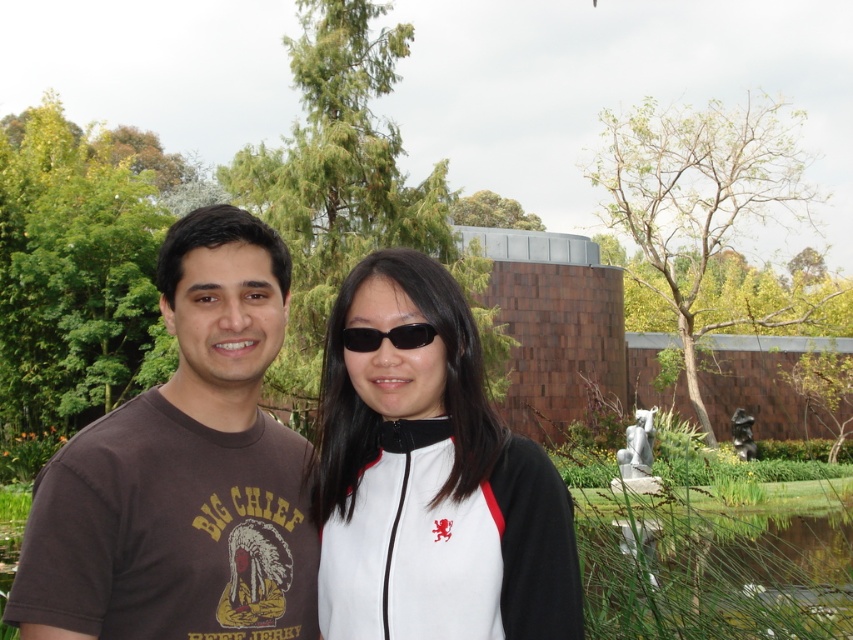
You are a GUI agent. You are given a task and a screenshot of the screen. Output one action in this format:
    pyautogui.click(x=<x>, y=<y>)
    Task: Click on the white matte jacket at center
    
    Given the screenshot: What is the action you would take?
    pyautogui.click(x=430, y=480)

Which is below, white matte jacket at center or black plastic sunglasses at center?

white matte jacket at center is below.

Locate an element on the screen. The image size is (853, 640). white matte jacket at center is located at coordinates (430, 480).

Identify the location of white matte jacket at center. This screenshot has width=853, height=640. (430, 480).

Between brown t-shirt at left and black plastic sunglasses at center, which one has less height?

black plastic sunglasses at center

Can you confirm if brown t-shirt at left is positioned to the left of black plastic sunglasses at center?

Indeed, brown t-shirt at left is positioned on the left side of black plastic sunglasses at center.

Between point (201, 252) and point (422, 326), which one is positioned behind?

The point (201, 252) is behind.

The image size is (853, 640). What are the coordinates of `brown t-shirt at left` in the screenshot? It's located at (183, 472).

Based on the photo, who is shorter, brown t-shirt at left or white matte jacket at center?

With less height is white matte jacket at center.

In the scene shown: Can you confirm if brown t-shirt at left is taller than white matte jacket at center?

Indeed, brown t-shirt at left has a greater height compared to white matte jacket at center.

Is point (149, 577) positioned behind point (370, 372)?

No, it is in front of (370, 372).

I want to click on brown t-shirt at left, so click(183, 472).